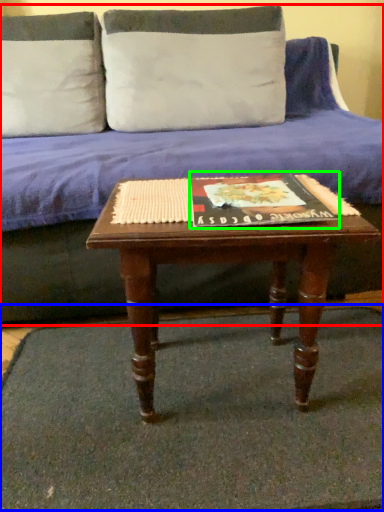
Question: Considering the real-world distances, which object is closest to studio couch (highlighted by a red box)? doormat (highlighted by a blue box) or paperback book (highlighted by a green box).

Choices:
 (A) doormat
 (B) paperback book

Answer: (A)